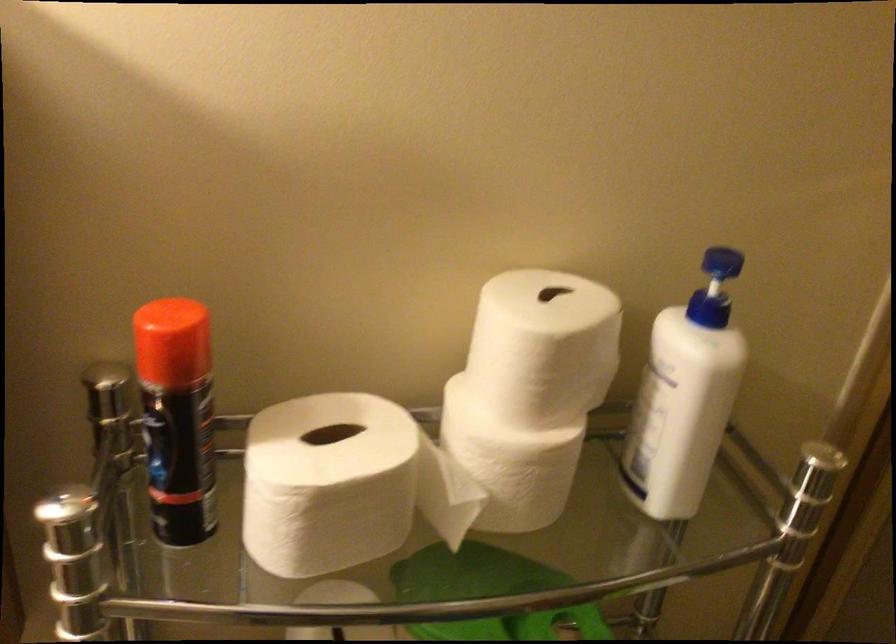
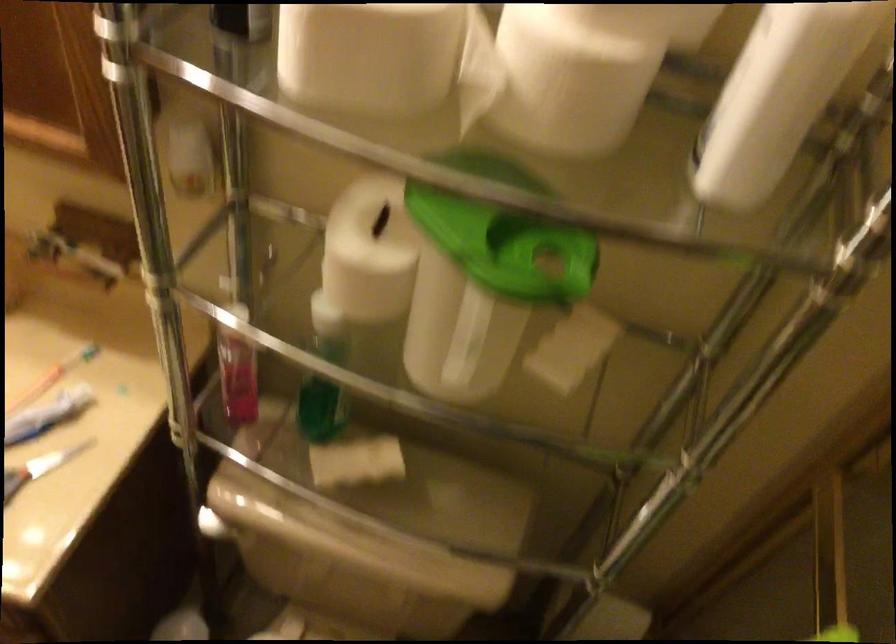
In the scene shown: Based on the continuous images, in which direction is the camera rotating?

The rotation direction of the camera is left-down.